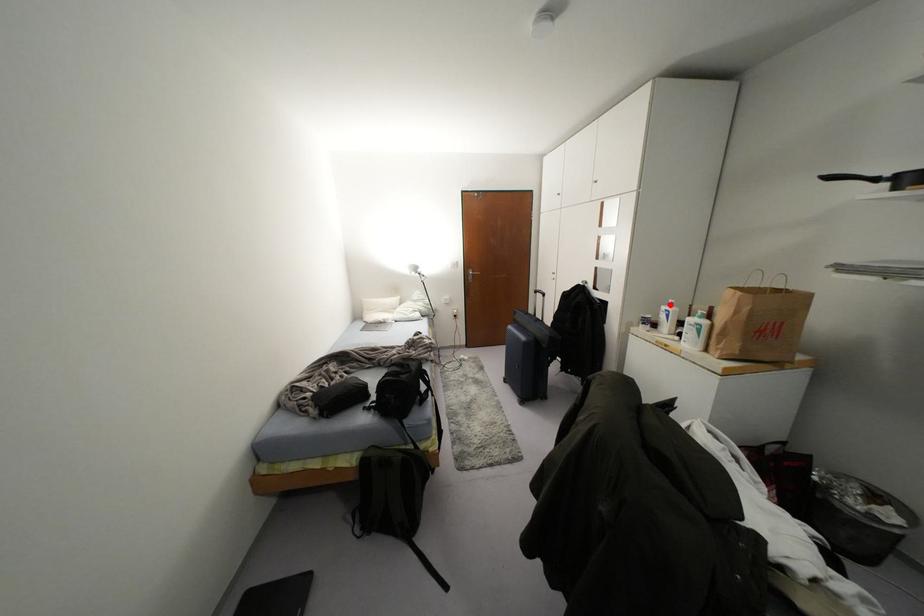
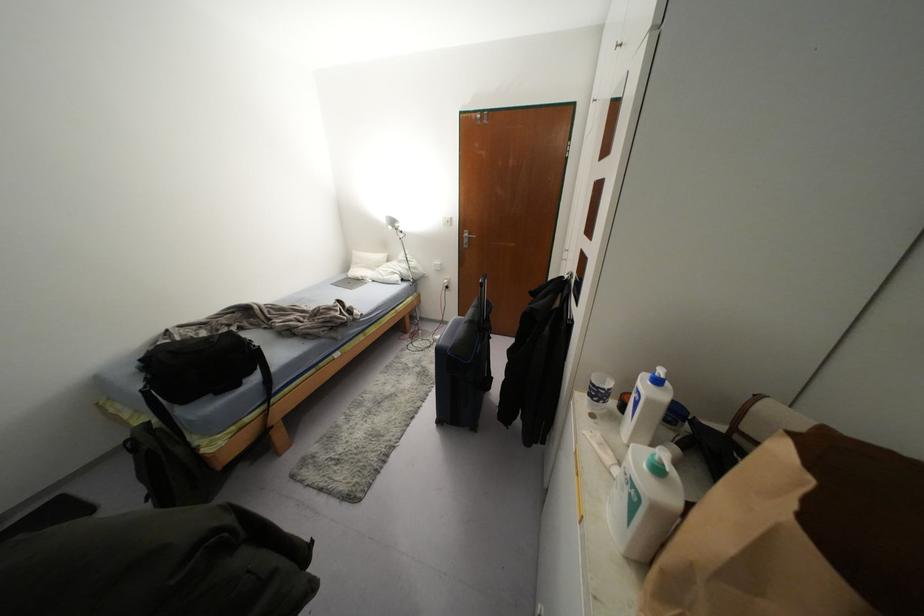
Find the pixel in the second image that matches the highlighted location in the first image.

(658, 381)